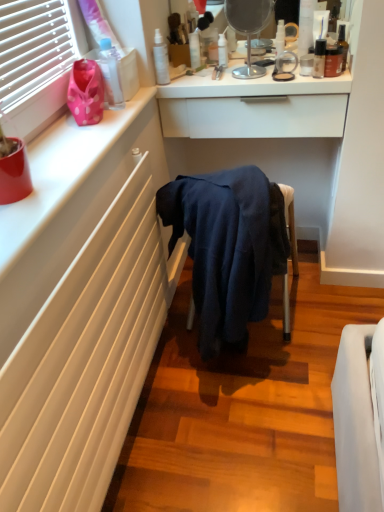
Where is `empty space that is ontop of white matte counter top at upper left`? The height and width of the screenshot is (512, 384). empty space that is ontop of white matte counter top at upper left is located at coordinates (67, 149).